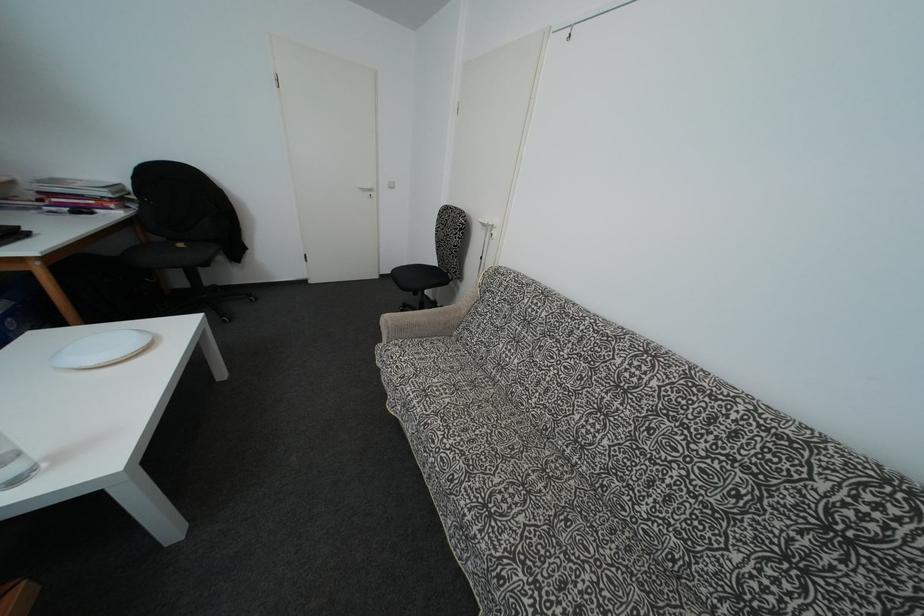
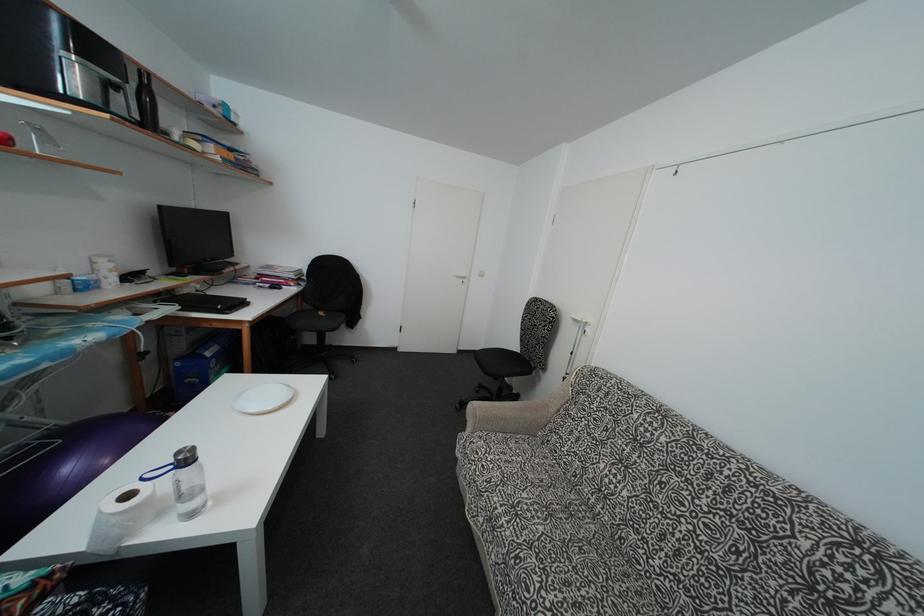
What movement of the cameraman would produce the second image?

The cameraman moved toward left, backward.